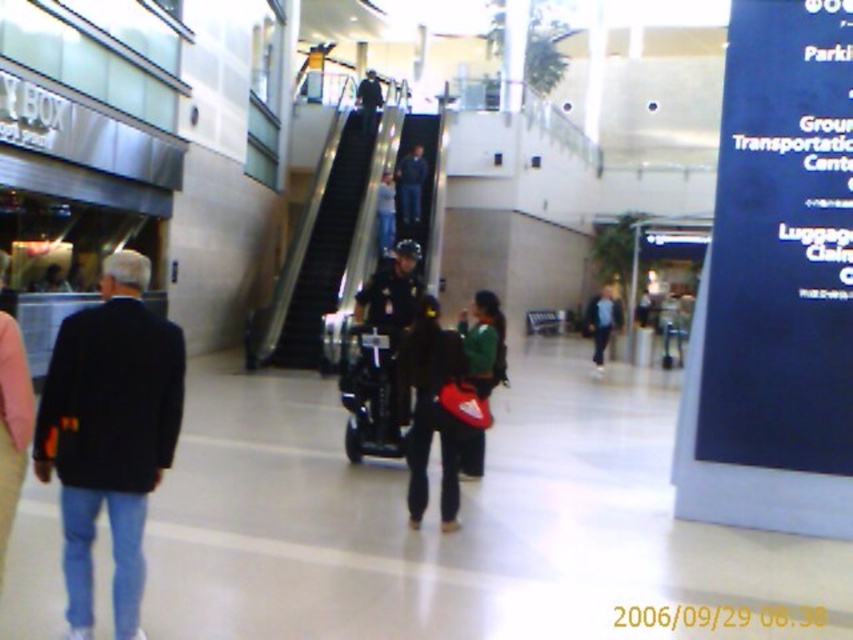
You are observing a scene in a transportation hub. You notice two objects labeled as dark blue uniform at center and dark blue jeans at center. Which of these two items is taller?

The dark blue uniform at center is taller than the dark blue jeans at center.

You are a traveler trying to navigate through the Ground Transportation Center. You see the black plastic escalator at upper center and the blue jeans at upper center. Which object is wider?

The black plastic escalator at upper center is wider than the blue jeans at upper center.

You are a traveler trying to locate the nearest escalator in the Ground Transportation Center. You see a dark blue uniform at upper center and a black plastic escalator at upper center. Which object is taller and can help you identify the escalator?

The black plastic escalator at upper center is much taller than the dark blue uniform at upper center, so the escalator is the taller object that can help you identify it.